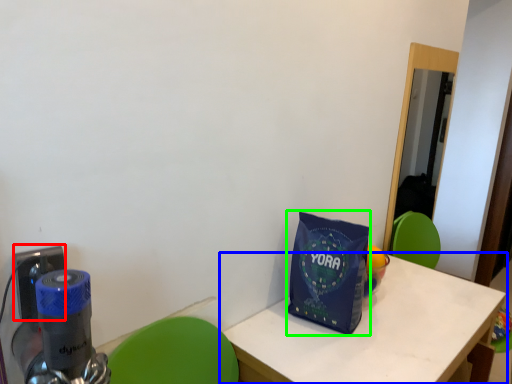
Question: Based on their relative distances, which object is farther from electric outlet (highlighted by a red box)? Choose from table (highlighted by a blue box) and tote bag (highlighted by a green box).

Choices:
 (A) table
 (B) tote bag

Answer: (A)